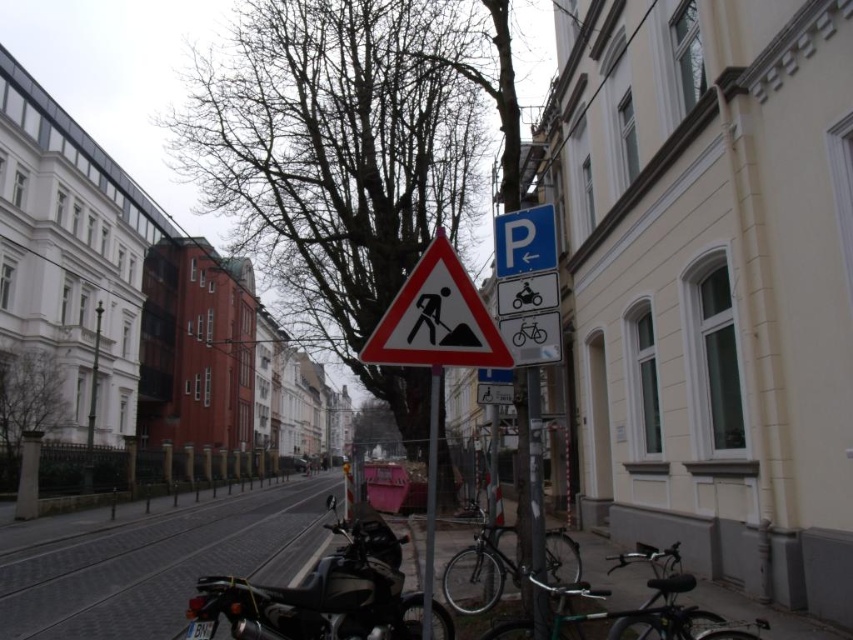
Question: Among these objects, which one is nearest to the camera?

Choices:
 (A) cobblestone pavement at lower left
 (B) metallic pole at center

Answer: (B)

Question: Which object is the closest to the dark green leafy tree at left?

Choices:
 (A) bare branches at center
 (B) metallic pole at center
 (C) smooth concrete pavement at lower center
 (D) blue plastic parking sign at upper center

Answer: (C)

Question: Considering the relative positions of smooth concrete pavement at lower center and white plastic triangle at center in the image provided, where is smooth concrete pavement at lower center located with respect to white plastic triangle at center?

Choices:
 (A) left
 (B) right

Answer: (A)

Question: Is cobblestone pavement at lower left positioned before white plastic triangle at center?

Choices:
 (A) no
 (B) yes

Answer: (A)

Question: Does dark green leafy tree at left lie in front of blue plastic parking sign at upper center?

Choices:
 (A) no
 (B) yes

Answer: (A)

Question: Which of the following is the farthest from the observer?

Choices:
 (A) (4, 566)
 (B) (363, 600)
 (C) (157, 580)

Answer: (A)